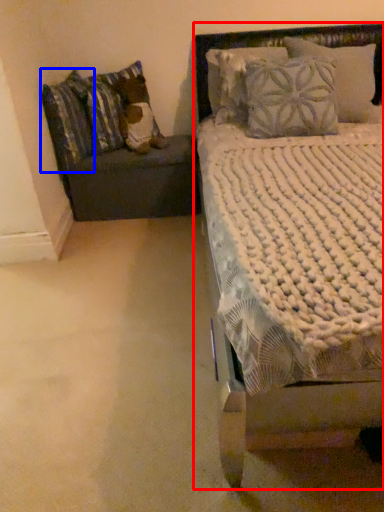
Question: Which point is closer to the camera, bed (highlighted by a red box) or pillow (highlighted by a blue box)?

Choices:
 (A) bed
 (B) pillow

Answer: (A)